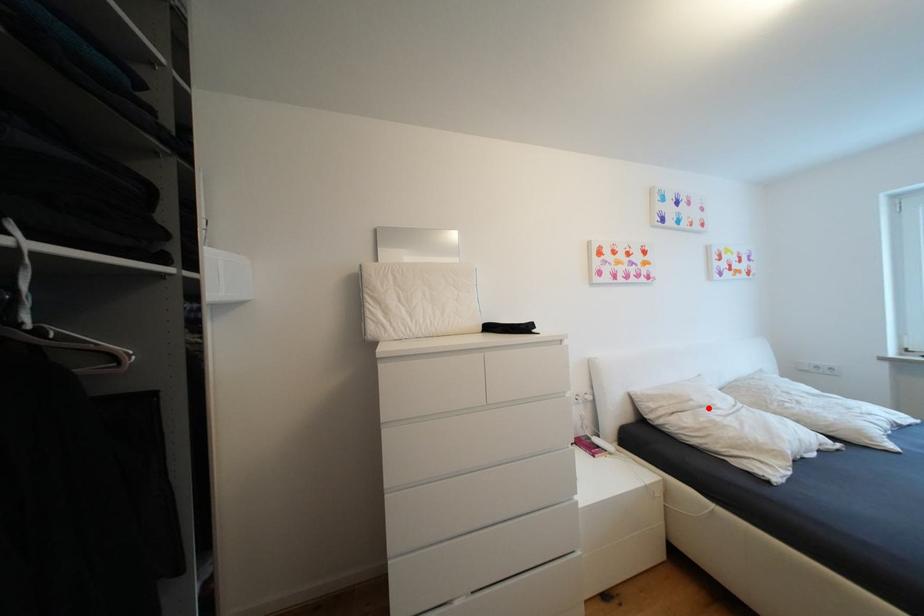
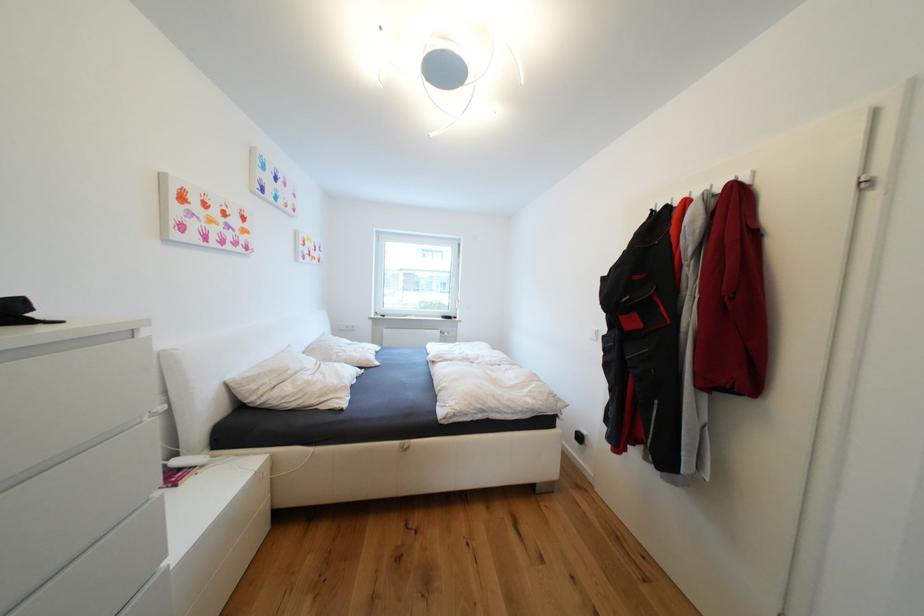
Where in the second image is the point corresponding to the highlighted location from the first image?

(304, 374)